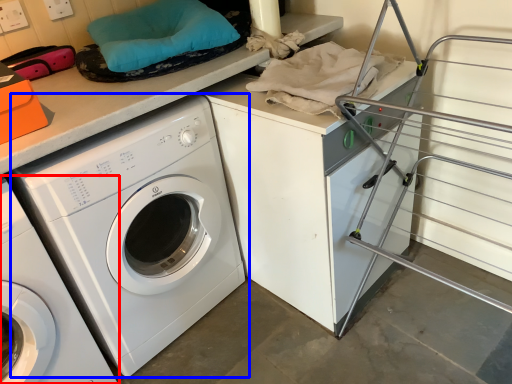
Question: Which object appears closest to the camera in this image, washing machine (highlighted by a red box) or washing machine (highlighted by a blue box)?

Choices:
 (A) washing machine
 (B) washing machine

Answer: (A)